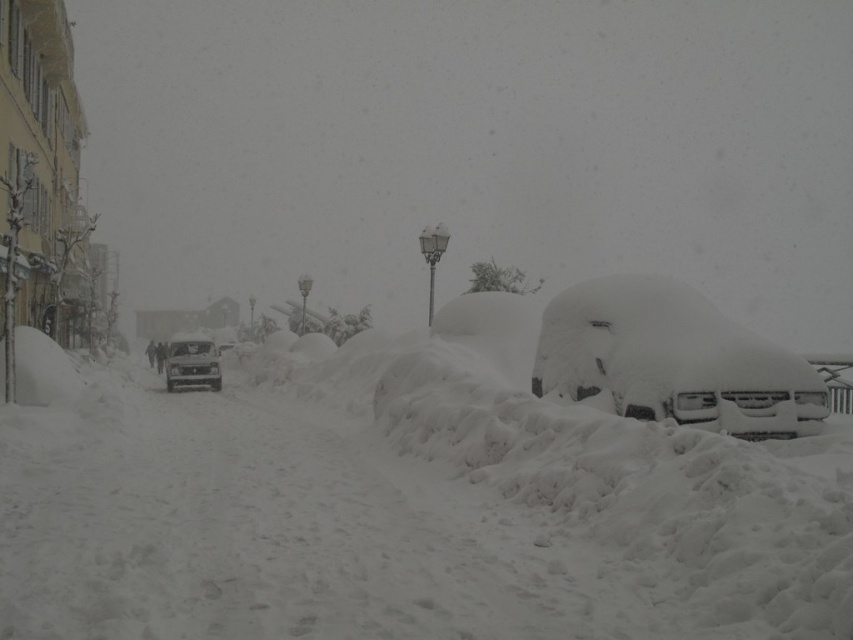
In the scene shown: Can you confirm if white fluffy snow at center is positioned to the left of white fluffy car at center?

Yes, white fluffy snow at center is to the left of white fluffy car at center.

Is white fluffy snow at center thinner than white fluffy car at center?

Incorrect, white fluffy snow at center's width is not less than white fluffy car at center's.

This screenshot has height=640, width=853. Describe the element at coordinates (405, 515) in the screenshot. I see `white fluffy snow at center` at that location.

Locate an element on the screen. The image size is (853, 640). white fluffy snow at center is located at coordinates (405, 515).

Who is taller, white fluffy car at center or shiny silver car at center?

Standing taller between the two is shiny silver car at center.

Is point (807, 387) positioned after point (193, 344)?

No, it is not.

Is point (610, 390) positioned behind point (209, 376)?

That is False.

Image resolution: width=853 pixels, height=640 pixels. I want to click on white fluffy car at center, so click(x=672, y=360).

Does white fluffy snow at center appear under shiny silver car at center?

Indeed, white fluffy snow at center is positioned under shiny silver car at center.

Where is `white fluffy snow at center`? This screenshot has height=640, width=853. white fluffy snow at center is located at coordinates (405, 515).